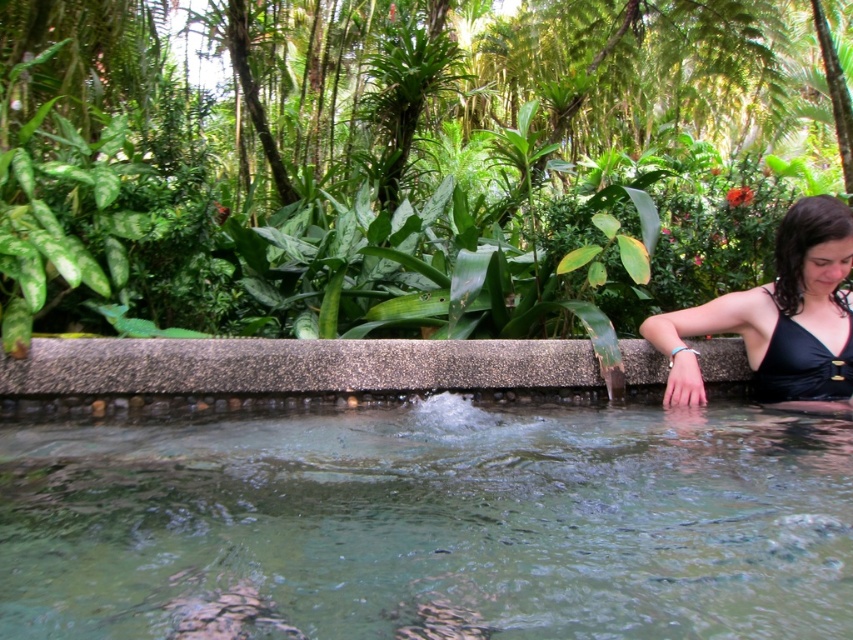
Question: Which is nearer to the gray concrete ledge at center?

Choices:
 (A) black matte swimsuit at right
 (B) clear water at center

Answer: (A)

Question: Which point is closer to the camera?

Choices:
 (A) (764, 388)
 (B) (62, 429)
 (C) (778, 304)
 (D) (88, 348)

Answer: (B)

Question: Can you confirm if clear water at center is smaller than black matte bikini top at right?

Choices:
 (A) yes
 (B) no

Answer: (B)

Question: Can you confirm if green leafy plants at upper center is thinner than gray concrete ledge at center?

Choices:
 (A) no
 (B) yes

Answer: (B)

Question: Which point is closer to the camera taking this photo?

Choices:
 (A) (190, 541)
 (B) (354, 243)
 (C) (792, 388)

Answer: (A)

Question: Is clear water at center further to the viewer compared to gray concrete ledge at center?

Choices:
 (A) yes
 (B) no

Answer: (B)